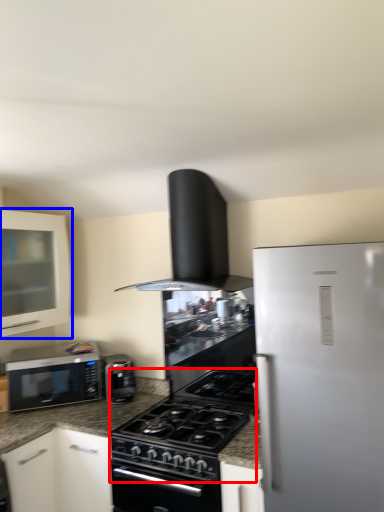
Question: Which object appears closest to the camera in this image, gas stove (highlighted by a red box) or cabinetry (highlighted by a blue box)?

Choices:
 (A) gas stove
 (B) cabinetry

Answer: (A)